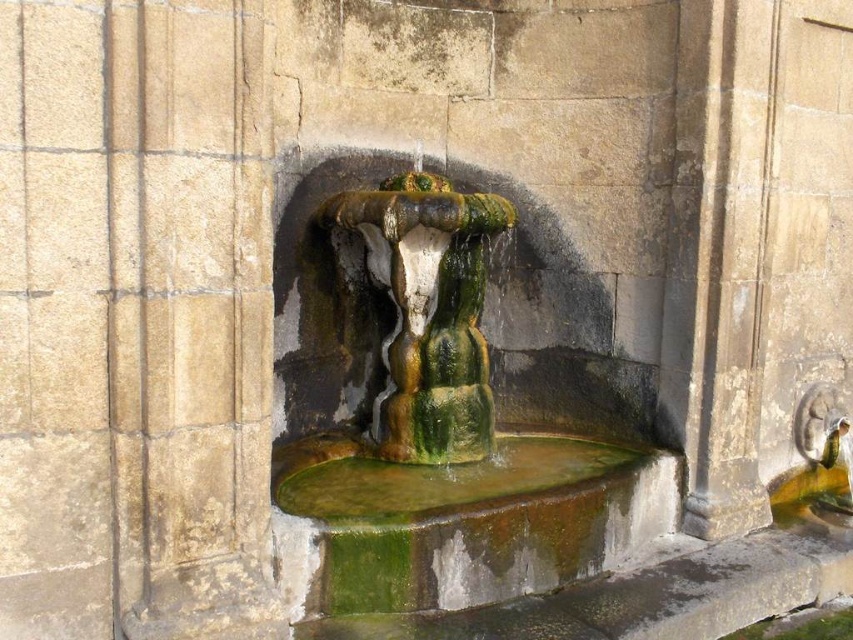
Question: Which point is closer to the camera taking this photo?

Choices:
 (A) (469, 467)
 (B) (750, 394)
 (C) (486, 248)

Answer: (A)

Question: Is green mossy stone fountain at center smaller than green glazed fountain at center?

Choices:
 (A) yes
 (B) no

Answer: (B)

Question: Which point appears farthest from the camera in this image?

Choices:
 (A) (354, 508)
 (B) (579, 387)
 (C) (721, 204)
 (D) (347, 214)

Answer: (B)

Question: Is smooth stone pillar at right positioned at the back of green glazed fountain at center?

Choices:
 (A) yes
 (B) no

Answer: (A)

Question: Is green mossy stone fountain at center further to camera compared to smooth stone pillar at right?

Choices:
 (A) yes
 (B) no

Answer: (B)

Question: Which of the following is the closest to the observer?

Choices:
 (A) green mossy water at center
 (B) green mossy stone fountain at center
 (C) green glazed fountain at center
 (D) smooth stone pillar at right

Answer: (B)